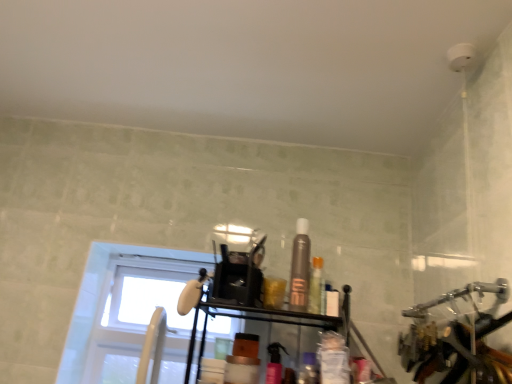
Question: Should I look upward or downward to see translucent plastic container at center, which is the 3th toiletry in left-to-right order?

Choices:
 (A) up
 (B) down

Answer: (B)

Question: Can you confirm if white glass window at upper left is positioned to the right of translucent plastic container at center, the 2th toiletry viewed from the right?

Choices:
 (A) no
 (B) yes

Answer: (A)

Question: Does white glass window at upper left have a smaller size compared to translucent plastic container at center, which is the 3th toiletry in left-to-right order?

Choices:
 (A) yes
 (B) no

Answer: (B)

Question: Are white glass window at upper left and translucent plastic container at center, which is the 3th toiletry in left-to-right order, beside each other?

Choices:
 (A) yes
 (B) no

Answer: (B)

Question: Considering the relative sizes of white glass window at upper left and translucent plastic container at center, the 2th toiletry viewed from the right, in the image provided, is white glass window at upper left taller than translucent plastic container at center, the 2th toiletry viewed from the right,?

Choices:
 (A) yes
 (B) no

Answer: (A)

Question: Is white glass window at upper left outside translucent plastic container at center, the 2th toiletry viewed from the right?

Choices:
 (A) yes
 (B) no

Answer: (A)

Question: Is white glass window at upper left positioned far away from translucent plastic container at center, the 2th toiletry viewed from the right?

Choices:
 (A) no
 (B) yes

Answer: (A)

Question: Is the position of translucent plastic container at center, the 2th toiletry viewed from the right, less distant than that of translucent plastic bottle at center, the 4th toiletry viewed from the left?

Choices:
 (A) no
 (B) yes

Answer: (B)

Question: From a real-world perspective, is translucent plastic container at center, the 2th toiletry viewed from the right, on translucent plastic bottle at center, the 4th toiletry viewed from the left?

Choices:
 (A) yes
 (B) no

Answer: (B)

Question: Considering the relative sizes of translucent plastic container at center, which is the 3th toiletry in left-to-right order, and translucent plastic bottle at center, which appears as the first toiletry when viewed from the right, in the image provided, is translucent plastic container at center, which is the 3th toiletry in left-to-right order, thinner than translucent plastic bottle at center, which appears as the first toiletry when viewed from the right,?

Choices:
 (A) yes
 (B) no

Answer: (B)

Question: Considering the relative sizes of translucent plastic container at center, the 2th toiletry viewed from the right, and translucent plastic bottle at center, the 4th toiletry viewed from the left, in the image provided, is translucent plastic container at center, the 2th toiletry viewed from the right, wider than translucent plastic bottle at center, the 4th toiletry viewed from the left,?

Choices:
 (A) no
 (B) yes

Answer: (B)

Question: Can you confirm if translucent plastic container at center, the 2th toiletry viewed from the right, is positioned to the right of translucent plastic bottle at center, which appears as the first toiletry when viewed from the right?

Choices:
 (A) yes
 (B) no

Answer: (B)

Question: Would you say translucent plastic container at center, which is the 3th toiletry in left-to-right order, is a long distance from translucent plastic bottle at center, which appears as the first toiletry when viewed from the right?

Choices:
 (A) yes
 (B) no

Answer: (B)

Question: Is satin brown spray can at center, the 2th toiletry in the left-to-right sequence, facing away from pink glossy spray can at center, the fourth toiletry when ordered from right to left?

Choices:
 (A) no
 (B) yes

Answer: (A)